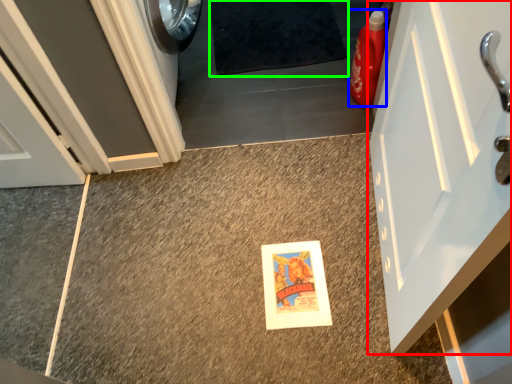
Question: Which is nearer to the door (highlighted by a red box)? cleaning product (highlighted by a blue box) or bath mat (highlighted by a green box).

Choices:
 (A) cleaning product
 (B) bath mat

Answer: (A)